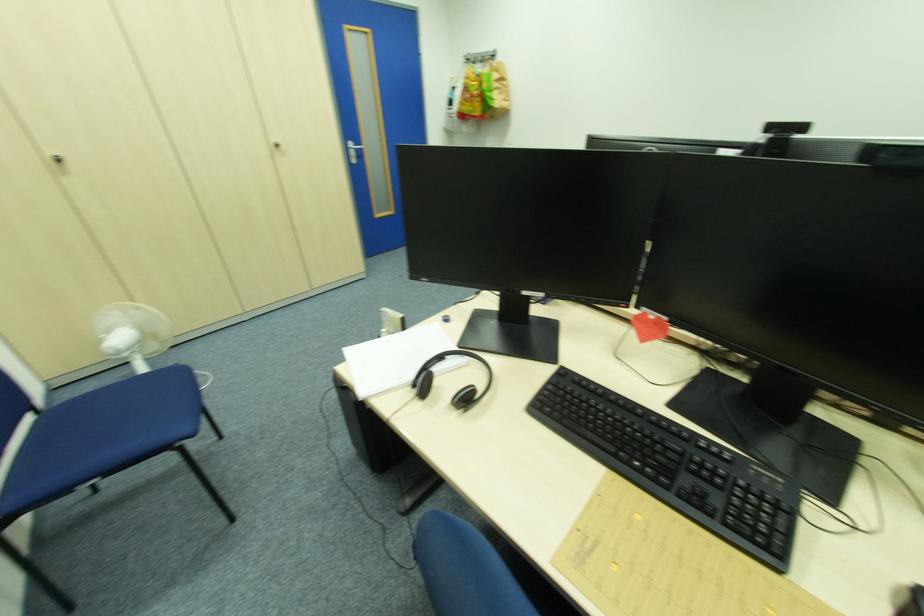
Where is `white notebook`? The height and width of the screenshot is (616, 924). white notebook is located at coordinates (397, 359).